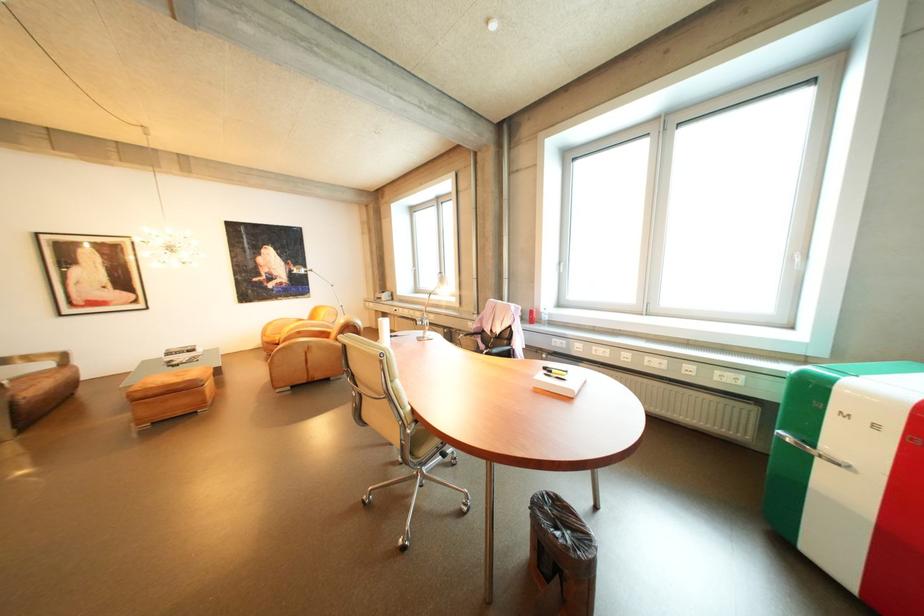
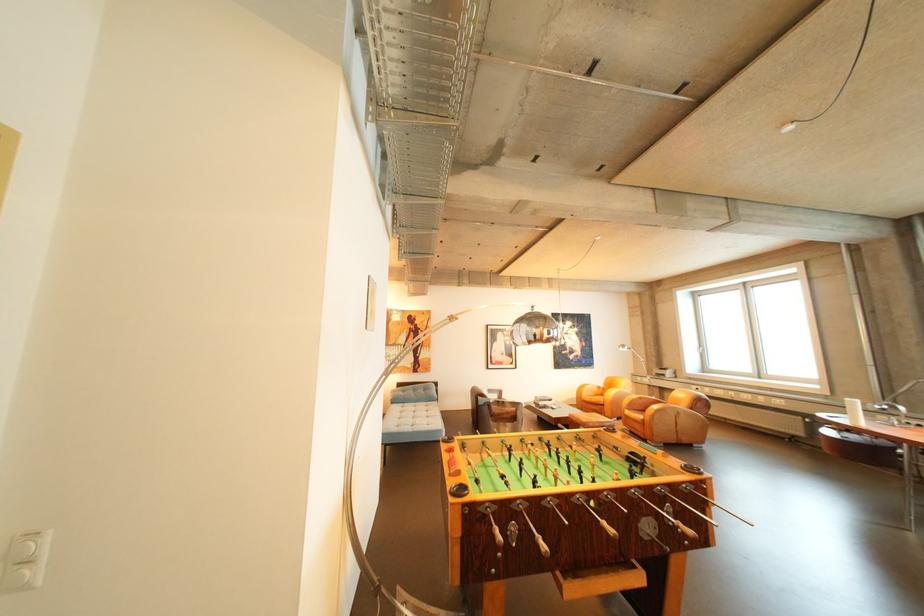
Where in the second image is the point corresponding to pixel 284 325 from the first image?

(594, 387)